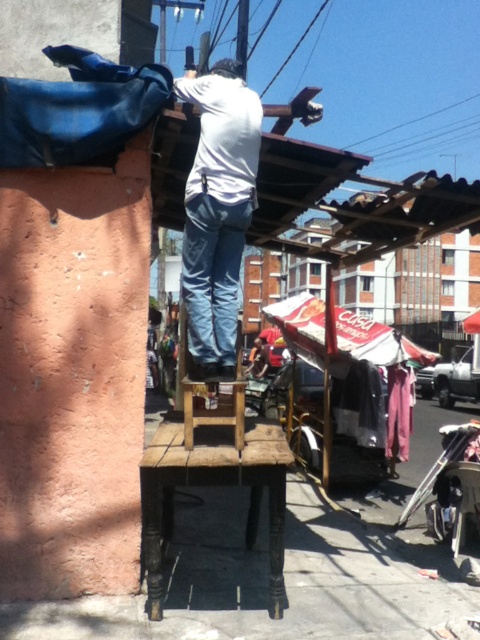
You are a delivery person standing in front of the wooden stool at center and the white matte shirt at center. Which object is closer to you?

The white matte shirt at center is closer to you because it is further to the viewer than the wooden stool at center.

In the scene shown: You are a passerby who wants to sit on the wooden stool at center. Is the white matte shirt at center currently blocking access to it?

The white matte shirt at center is positioned over wooden stool at center, so it is blocking access to the wooden stool at center.

You are a pedestrian passing by the man working on the wooden structure. You notice the white matte shirt at center and the wooden stool at center. Which object is positioned more to the right from your perspective?

The white matte shirt at center is to the right of the wooden stool at center, so the white matte shirt at center is positioned more to the right.